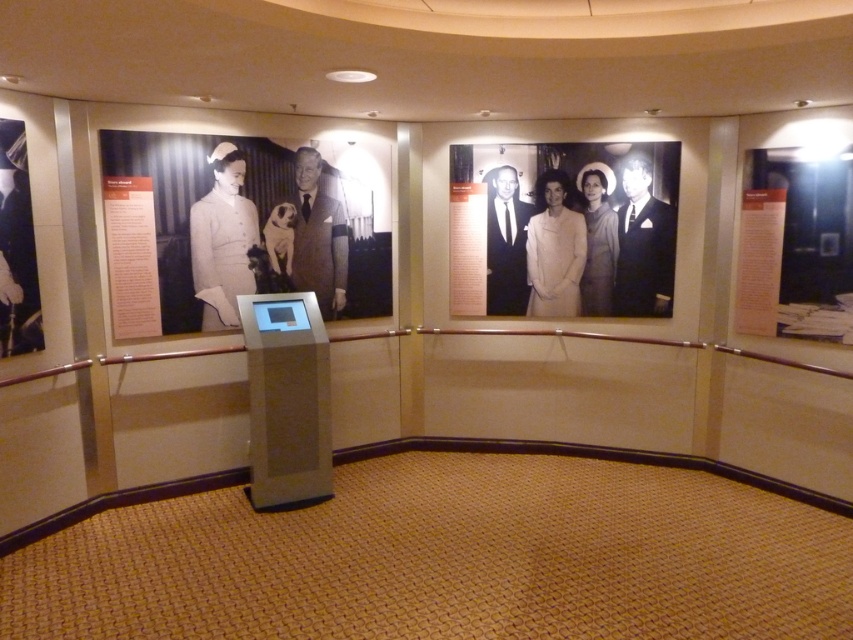
Question: Which point is farther to the camera?

Choices:
 (A) black suit at center
 (B) smooth beige dress at center

Answer: (A)

Question: Can you confirm if white matte nurse uniform at upper left is thinner than smooth beige suit at center?

Choices:
 (A) yes
 (B) no

Answer: (B)

Question: Can you confirm if white matte nurse uniform at upper left is positioned below smooth beige dress at center?

Choices:
 (A) yes
 (B) no

Answer: (A)

Question: Among these points, which one is farthest from the camera?

Choices:
 (A) (339, 262)
 (B) (640, 232)
 (C) (596, 298)
 (D) (578, 237)

Answer: (C)

Question: Which point is closer to the camera?

Choices:
 (A) black suit at center
 (B) smooth beige suit at center
 (C) white matte nurse uniform at upper left

Answer: (C)

Question: Does black glossy poster at center have a larger size compared to white paper at right?

Choices:
 (A) no
 (B) yes

Answer: (B)